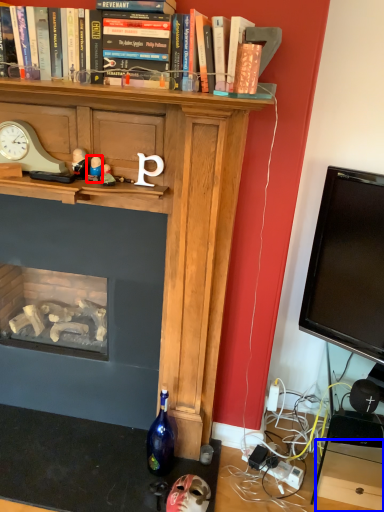
Question: Which point is further to the camera, toy (highlighted by a red box) or drawer (highlighted by a blue box)?

Choices:
 (A) toy
 (B) drawer

Answer: (B)